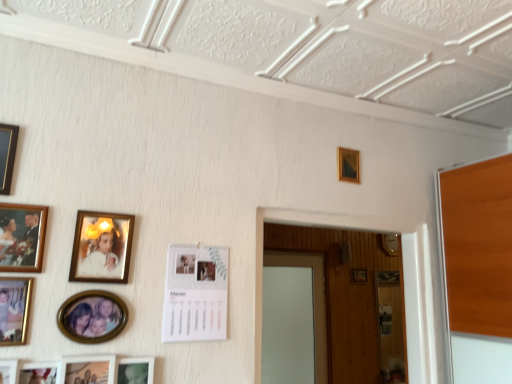
Question: Is wooden picture frame at upper center, arranged as the 1th picture frame when viewed from the back, to the left or to the right of matte gold picture frame at lower left, placed as the seventh picture frame when sorted from front to back, in the image?

Choices:
 (A) right
 (B) left

Answer: (A)

Question: Is wooden picture frame at upper center, acting as the first picture frame starting from the right, spatially inside matte gold picture frame at lower left, the 6th picture frame viewed from the right, or outside of it?

Choices:
 (A) outside
 (B) inside

Answer: (A)

Question: Which is nearer to the matte gold picture frame at upper left, positioned as the ninth picture frame in front-to-back order?

Choices:
 (A) matte gold picture frame at lower left, which appears as the 6th picture frame when viewed from the back
 (B) white paper calendar at center, the tenth picture frame in the left-to-right sequence
 (C) matte black picture frame at upper left, which appears as the eighth picture frame when viewed from the back
 (D) matte white photo frame at lower left, the fifth picture frame viewed from the back
 (E) matte gold picture frame at left, which is counted as the 7th picture frame, starting from the back

Answer: (A)

Question: Estimate the real-world distances between objects in this image. Which object is closer to the matte black picture frame at upper left, the twelfth picture frame from the right?

Choices:
 (A) wooden picture frame at upper center, arranged as the 1th picture frame when viewed from the back
 (B) matte gold picture frame at left, the sixth picture frame when ordered from front to back
 (C) gold metallic picture frame at upper center, arranged as the eleventh picture frame when viewed from the front
 (D) wooden photo frame at lower left, which is the first picture frame in front-to-back order
 (E) matte white photo frame at lower left, which is the fourth picture frame from right to left

Answer: (B)